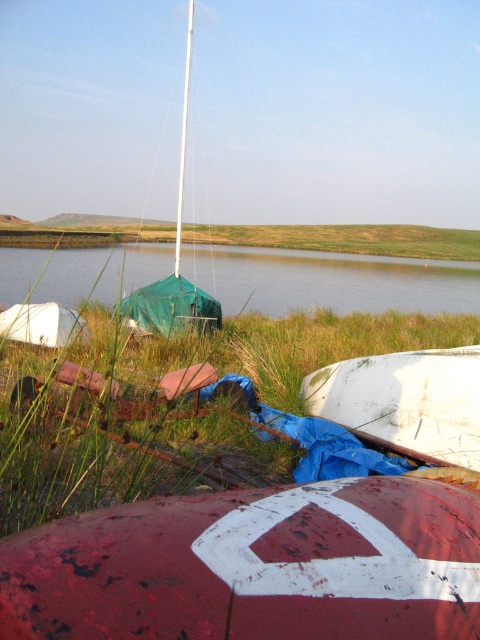
You are standing at the lakeside and notice the red painted buoy at center and the green grass at center. Which object is taller when you look at them from where you are standing?

The green grass at center is taller than the red painted buoy at center.

Consider the image. You are standing at the lakeside and see the red painted buoy at center and the green grass at center. Which object is closer to the water?

The red painted buoy at center is below green grass at center, so it is closer to the water.

Based on the scene description, which object takes up more area in the image between the green grass at center and the green fabric water at center?

The green fabric water at center occupies more area than the green grass at center according to the description.